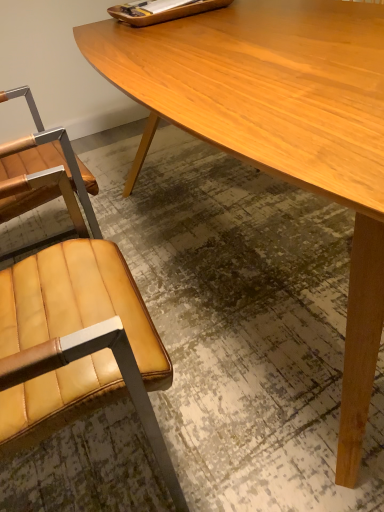
Describe the element at coordinates (72, 319) in the screenshot. This screenshot has width=384, height=512. I see `leather at left` at that location.

The height and width of the screenshot is (512, 384). Find the location of `leather at left`. leather at left is located at coordinates (72, 319).

Where is `leather at left`? This screenshot has width=384, height=512. leather at left is located at coordinates (72, 319).